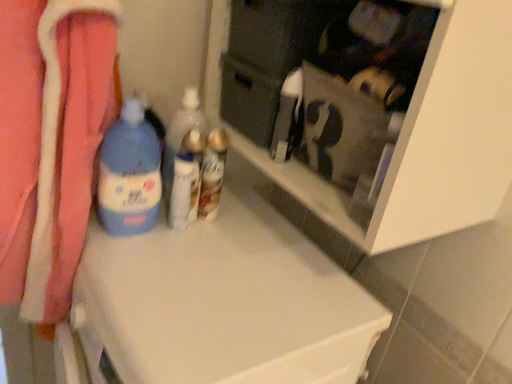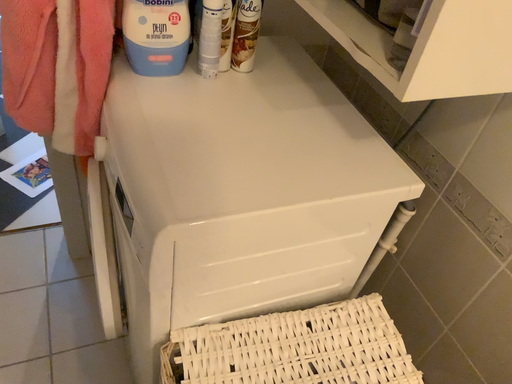
Question: Which way did the camera rotate in the video?

Choices:
 (A) rotated upward
 (B) rotated downward

Answer: (B)